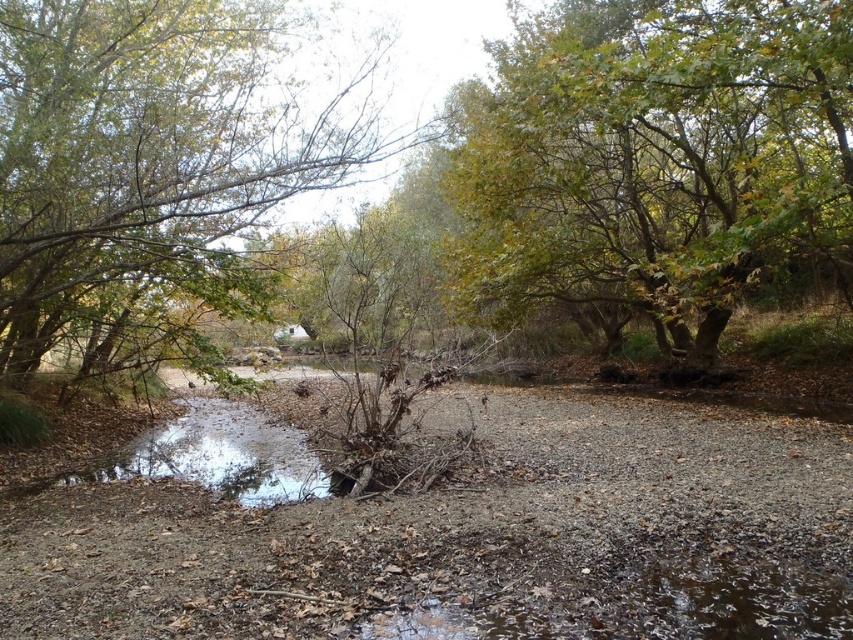
Question: Which point is farther to the camera?

Choices:
 (A) clear water at center
 (B) green leafy tree at upper left

Answer: (B)

Question: Can you confirm if green leafy tree at upper left is positioned to the right of clear water at center?

Choices:
 (A) yes
 (B) no

Answer: (A)

Question: Estimate the real-world distances between objects in this image. Which object is farther from the clear water at center?

Choices:
 (A) green leafy tree at center
 (B) green leafy tree at upper left

Answer: (A)

Question: Can you confirm if green leafy tree at upper left is wider than clear water at center?

Choices:
 (A) no
 (B) yes

Answer: (A)

Question: Is green leafy tree at center smaller than clear water at center?

Choices:
 (A) no
 (B) yes

Answer: (A)

Question: Based on their relative distances, which object is farther from the green leafy tree at center?

Choices:
 (A) clear water at center
 (B) green leafy tree at upper left

Answer: (B)